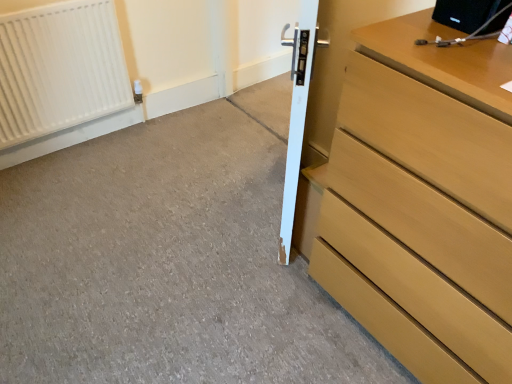
Question: Is smooth concrete at center wider than light brown wood chest of drawers at right?

Choices:
 (A) yes
 (B) no

Answer: (A)

Question: Is smooth concrete at center directly adjacent to light brown wood chest of drawers at right?

Choices:
 (A) no
 (B) yes

Answer: (A)

Question: Could light brown wood chest of drawers at right be considered to be inside smooth concrete at center?

Choices:
 (A) no
 (B) yes

Answer: (A)

Question: Is smooth concrete at center in front of light brown wood chest of drawers at right?

Choices:
 (A) yes
 (B) no

Answer: (B)

Question: Can you confirm if smooth concrete at center is positioned to the right of light brown wood chest of drawers at right?

Choices:
 (A) yes
 (B) no

Answer: (B)

Question: From the image's perspective, is smooth concrete at center beneath light brown wood chest of drawers at right?

Choices:
 (A) no
 (B) yes

Answer: (B)

Question: From a real-world perspective, is white matte radiator at upper left physically below light brown wood chest of drawers at right?

Choices:
 (A) no
 (B) yes

Answer: (B)

Question: Is white matte radiator at upper left bigger than light brown wood chest of drawers at right?

Choices:
 (A) no
 (B) yes

Answer: (A)

Question: Considering the relative positions of white matte radiator at upper left and light brown wood chest of drawers at right in the image provided, is white matte radiator at upper left behind light brown wood chest of drawers at right?

Choices:
 (A) yes
 (B) no

Answer: (A)

Question: Does white matte radiator at upper left have a lesser height compared to light brown wood chest of drawers at right?

Choices:
 (A) yes
 (B) no

Answer: (A)

Question: From the image's perspective, is white matte radiator at upper left below light brown wood chest of drawers at right?

Choices:
 (A) yes
 (B) no

Answer: (B)

Question: Is white matte radiator at upper left positioned with its back to light brown wood chest of drawers at right?

Choices:
 (A) yes
 (B) no

Answer: (B)

Question: Would you say white glossy door at center contains light brown wood chest of drawers at right?

Choices:
 (A) no
 (B) yes

Answer: (A)